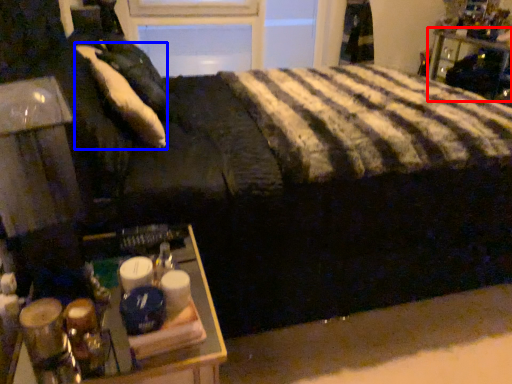
Question: Which object appears closest to the camera in this image, furniture (highlighted by a red box) or pillow (highlighted by a blue box)?

Choices:
 (A) furniture
 (B) pillow

Answer: (B)